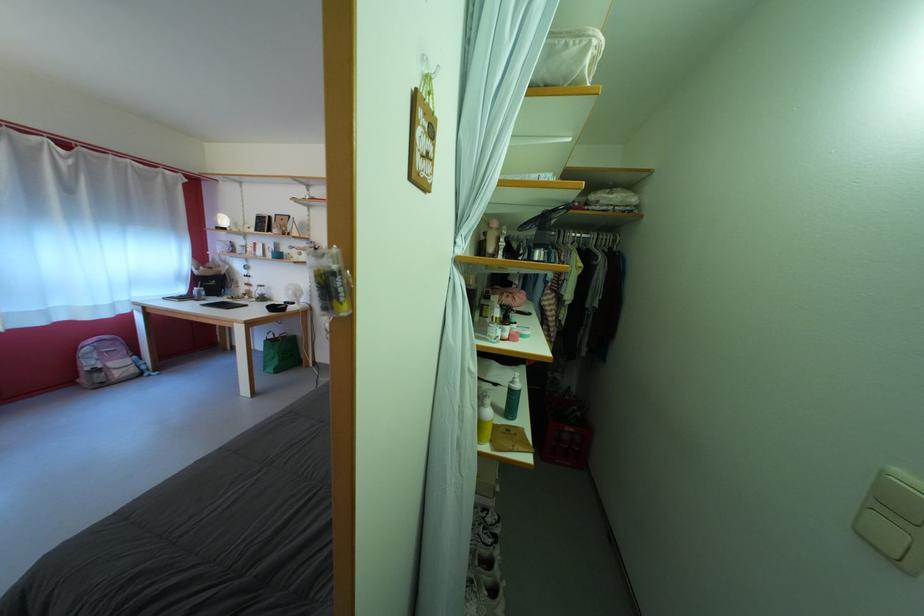
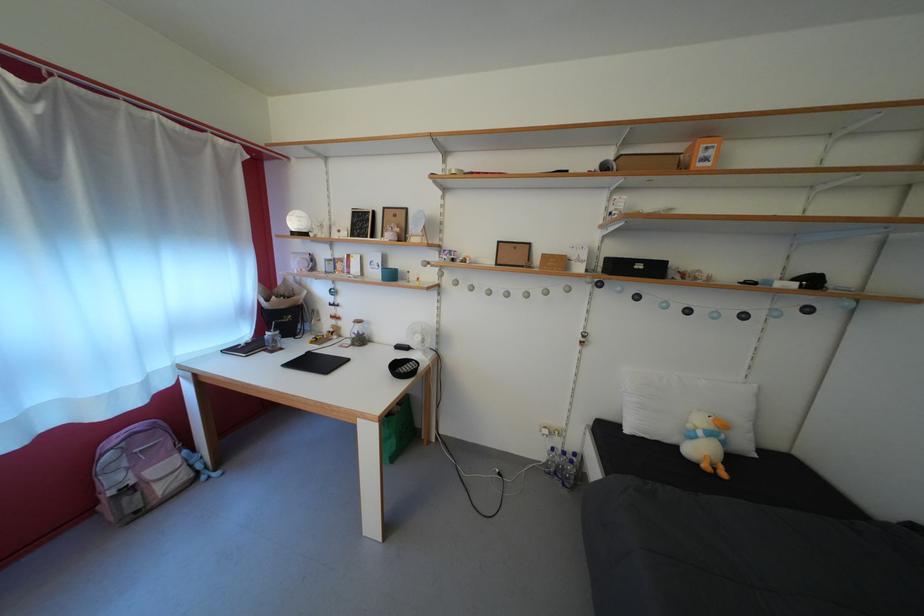
What movement of the cameraman would produce the second image?

The movement direction of the cameraman is left, forward.